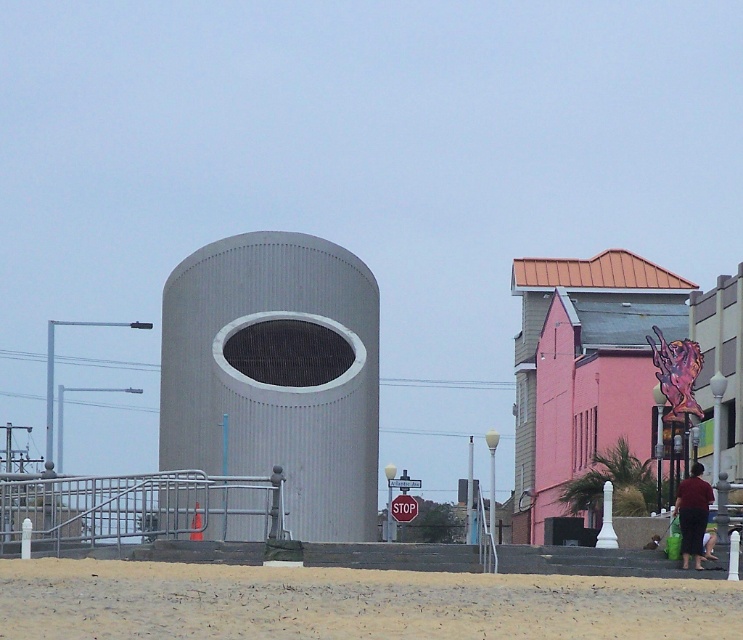
Question: Which object is the farthest from the dark red fabric pants at lower right?

Choices:
 (A) red plastic stop sign at center
 (B) gray corrugated metal cylinder at center
 (C) pink matte building at upper right

Answer: (C)

Question: Is gray corrugated metal cylinder at center smaller than pink matte building at upper right?

Choices:
 (A) yes
 (B) no

Answer: (A)

Question: Does pink matte building at upper right have a lesser width compared to red plastic stop sign at center?

Choices:
 (A) yes
 (B) no

Answer: (B)

Question: Which point is farther to the camera?

Choices:
 (A) pink matte building at upper right
 (B) dark red fabric pants at lower right

Answer: (A)

Question: From the image, what is the correct spatial relationship of gray corrugated metal cylinder at center in relation to dark red fabric pants at lower right?

Choices:
 (A) above
 (B) below

Answer: (A)

Question: Which object is the farthest from the red plastic stop sign at center?

Choices:
 (A) dark red fabric pants at lower right
 (B) gray corrugated metal cylinder at center

Answer: (A)